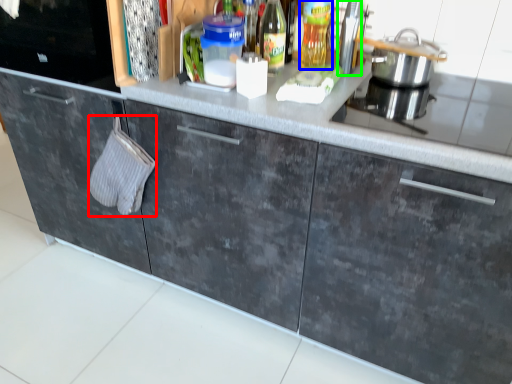
Question: Considering the real-world distances, which object is farthest from hand towel (highlighted by a red box)? bottle (highlighted by a blue box) or appliance (highlighted by a green box)?

Choices:
 (A) bottle
 (B) appliance

Answer: (B)